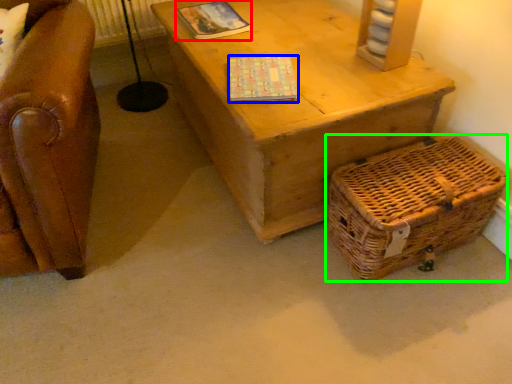
Question: Based on their relative distances, which object is nearer to magazine (highlighted by a red box)? Choose from magazine (highlighted by a blue box) and basket (highlighted by a green box).

Choices:
 (A) magazine
 (B) basket

Answer: (A)